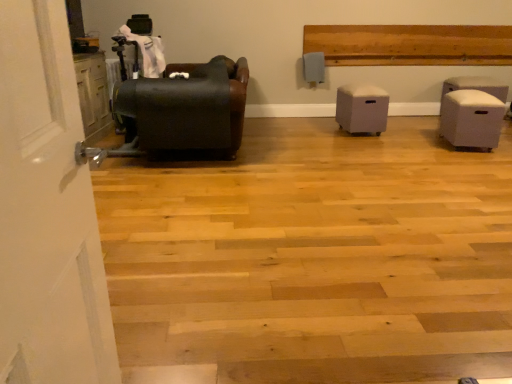
Question: From the image's perspective, is white fabric ottoman at right, marked as the 3th furniture in a left-to-right arrangement, located above matte black leather armchair at left, placed as the 3th furniture when sorted from right to left?

Choices:
 (A) no
 (B) yes

Answer: (A)

Question: Can you confirm if white fabric ottoman at right, marked as the 3th furniture in a left-to-right arrangement, is smaller than matte black leather armchair at left, arranged as the first furniture when viewed from the left?

Choices:
 (A) no
 (B) yes

Answer: (B)

Question: Is white fabric ottoman at right, the first furniture in the right-to-left sequence, outside of matte black leather armchair at left, arranged as the first furniture when viewed from the left?

Choices:
 (A) yes
 (B) no

Answer: (A)

Question: Can matte black leather armchair at left, placed as the 3th furniture when sorted from right to left, be found inside white fabric ottoman at right, the first furniture in the right-to-left sequence?

Choices:
 (A) no
 (B) yes

Answer: (A)

Question: Does white fabric ottoman at right, the first furniture in the right-to-left sequence, have a lesser height compared to matte black leather armchair at left, placed as the 3th furniture when sorted from right to left?

Choices:
 (A) yes
 (B) no

Answer: (A)

Question: From a real-world perspective, is white fabric ottoman at right, marked as the 3th furniture in a left-to-right arrangement, positioned under matte black leather armchair at left, arranged as the first furniture when viewed from the left, based on gravity?

Choices:
 (A) no
 (B) yes

Answer: (B)

Question: Does matte black leather armchair at left, placed as the 3th furniture when sorted from right to left, have a smaller size compared to white fabric ottoman at right, marked as the 3th furniture in a left-to-right arrangement?

Choices:
 (A) yes
 (B) no

Answer: (B)

Question: Does matte black leather armchair at left, placed as the 3th furniture when sorted from right to left, have a greater width compared to white fabric ottoman at right, the first furniture in the right-to-left sequence?

Choices:
 (A) no
 (B) yes

Answer: (B)

Question: From the image's perspective, is matte black leather armchair at left, arranged as the first furniture when viewed from the left, located beneath white fabric ottoman at right, the first furniture in the right-to-left sequence?

Choices:
 (A) no
 (B) yes

Answer: (A)

Question: Can you confirm if matte black leather armchair at left, placed as the 3th furniture when sorted from right to left, is thinner than white fabric ottoman at right, marked as the 3th furniture in a left-to-right arrangement?

Choices:
 (A) no
 (B) yes

Answer: (A)

Question: Is matte black leather armchair at left, placed as the 3th furniture when sorted from right to left, positioned behind white fabric ottoman at right, marked as the 3th furniture in a left-to-right arrangement?

Choices:
 (A) yes
 (B) no

Answer: (B)

Question: Could you tell me if matte black leather armchair at left, placed as the 3th furniture when sorted from right to left, is turned towards white fabric ottoman at right, the first furniture in the right-to-left sequence?

Choices:
 (A) yes
 (B) no

Answer: (B)

Question: Could you tell me if white fabric ottoman at right, the first furniture in the right-to-left sequence, is facing light gray fabric ottoman at center, which is the second furniture in left-to-right order?

Choices:
 (A) yes
 (B) no

Answer: (A)